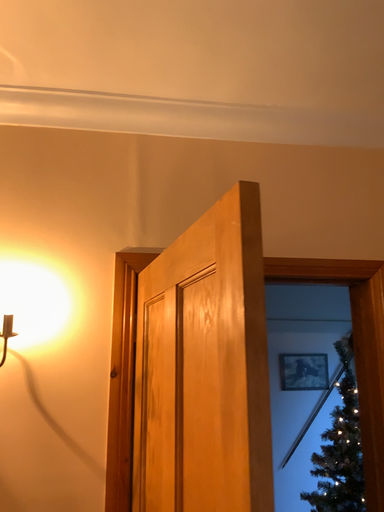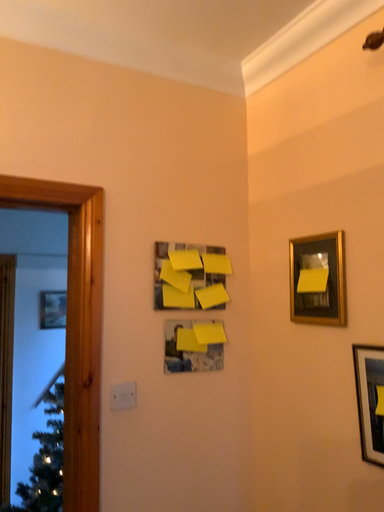
Question: Which way did the camera rotate in the video?

Choices:
 (A) rotated left
 (B) rotated right

Answer: (B)